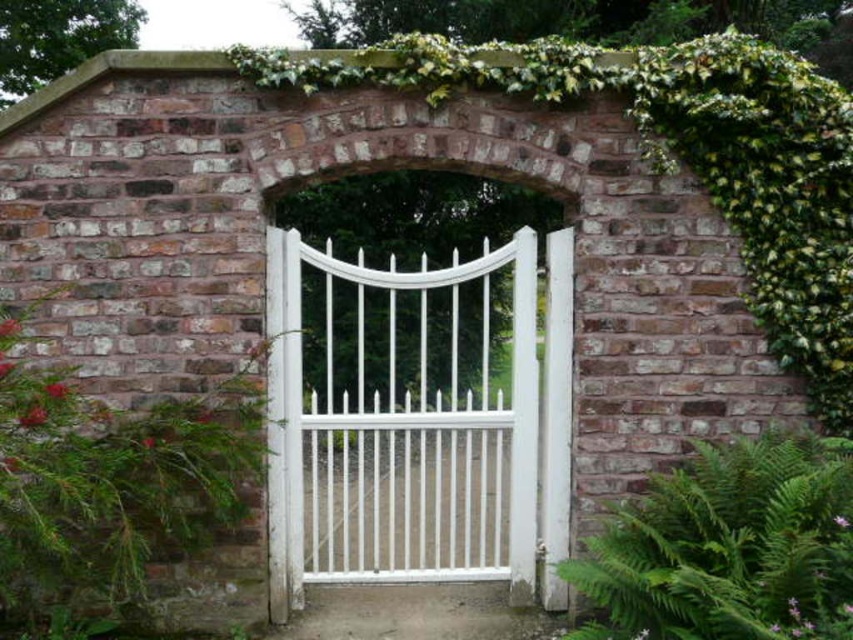
Is point (305, 477) positioned after point (616, 634)?

Yes, it is behind point (616, 634).

Who is more distant from viewer, (x=358, y=516) or (x=740, y=563)?

Positioned behind is point (x=358, y=516).

The width and height of the screenshot is (853, 640). What are the coordinates of `white painted metal gate at center` in the screenshot? It's located at (399, 438).